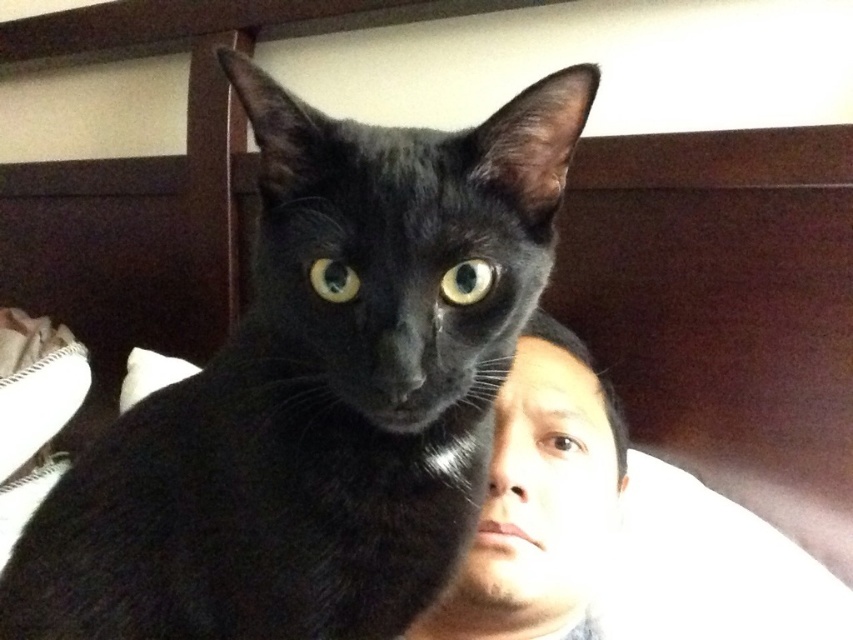
You are a photographer trying to capture a closeup of the black glossy cat at center and smooth skin face at center. Which object is positioned higher in the frame?

The black glossy cat at center is located above the smooth skin face at center, so it is positioned higher in the frame.

You are a photographer trying to capture a close up of both the black glossy cat at center and the smooth skin face at center in the scene. Based on their sizes, which one would you need to move closer to the camera to ensure both are in focus?

The black glossy cat at center is taller than the smooth skin face at center. To ensure both are in focus, you should move the smooth skin face at center closer to the camera since it is smaller and needs to be magnified to match the size of the cat in the frame.